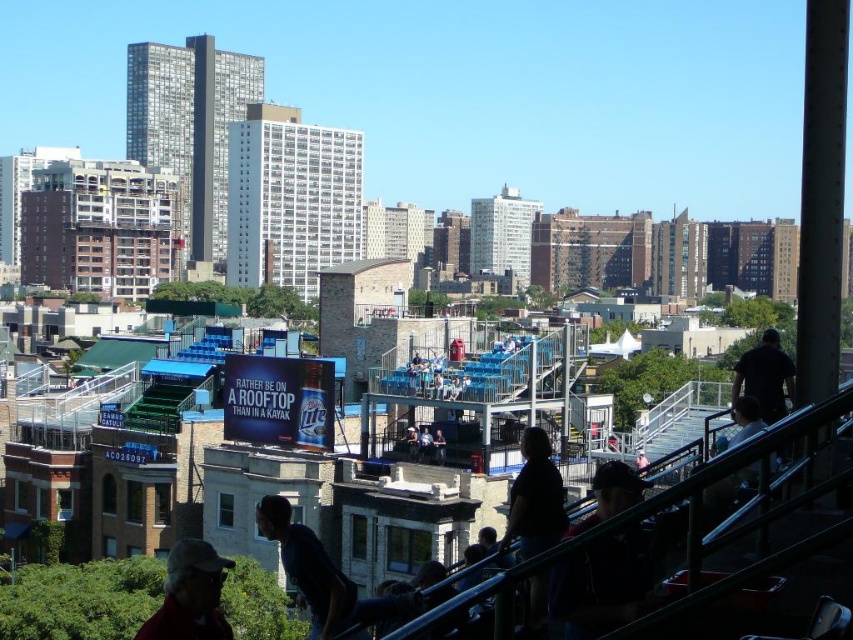
Question: Which point is closer to the camera?

Choices:
 (A) dark blue shirt at center
 (B) dark matte shirt at lower right
 (C) red fabric cap at lower left
 (D) black matte shirt at upper right

Answer: (B)

Question: Is dark blue shirt at center above red fabric cap at lower left?

Choices:
 (A) yes
 (B) no

Answer: (A)

Question: Does dark blue shirt at center appear under black matte shirt at upper right?

Choices:
 (A) yes
 (B) no

Answer: (A)

Question: In this image, where is dark matte shirt at lower right located relative to red fabric cap at lower left?

Choices:
 (A) left
 (B) right

Answer: (B)

Question: Based on their relative distances, which object is farther from the red fabric cap at lower left?

Choices:
 (A) dark blue shirt at center
 (B) black matte shirt at upper right

Answer: (B)

Question: Which object is the farthest from the red fabric cap at lower left?

Choices:
 (A) dark blue shirt at center
 (B) black matte shirt at upper right

Answer: (B)